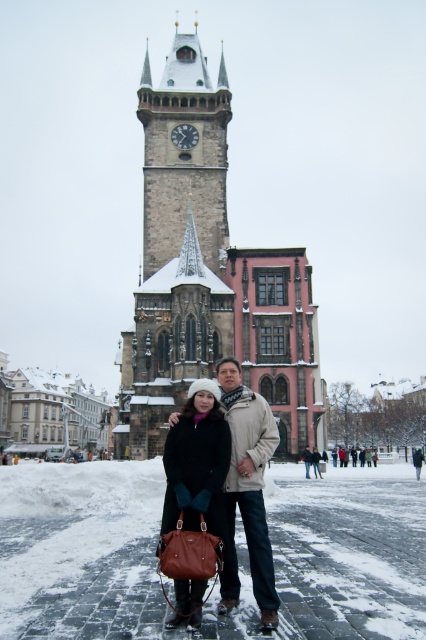
Question: Does white powdery snow at center appear under matte black coat at center?

Choices:
 (A) no
 (B) yes

Answer: (B)

Question: Considering the real-world distances, which object is farthest from the beige wool scarf at center?

Choices:
 (A) white powdery snow at center
 (B) matte black coat at center
 (C) stone clock tower at center

Answer: (C)

Question: In this image, where is stone clock tower at center located relative to beige wool scarf at center?

Choices:
 (A) right
 (B) left

Answer: (B)

Question: Which is nearer to the stone clock tower at center?

Choices:
 (A) beige wool scarf at center
 (B) white powdery snow at center
 (C) matte black coat at center

Answer: (C)

Question: Which of the following is the farthest from the observer?

Choices:
 (A) (227, 232)
 (B) (322, 556)
 (C) (310, 458)
 (D) (238, 493)

Answer: (A)

Question: Observing the image, what is the correct spatial positioning of stone clock tower at center in reference to beige wool scarf at center?

Choices:
 (A) left
 (B) right

Answer: (A)